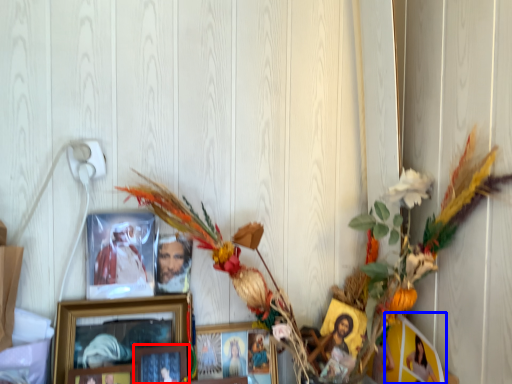
Question: Which object is further to the camera taking this photo, picture frame (highlighted by a red box) or picture frame (highlighted by a blue box)?

Choices:
 (A) picture frame
 (B) picture frame

Answer: (A)